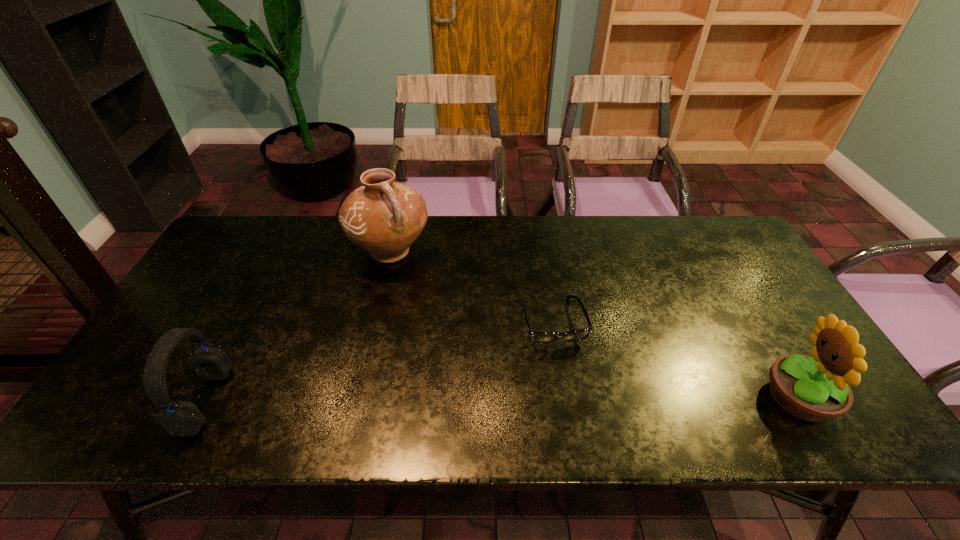
This screenshot has height=540, width=960. In order to click on vacant region located on the face of the sunflower in this screenshot , I will do `click(711, 397)`.

Image resolution: width=960 pixels, height=540 pixels. Identify the location of free location located 0.250m on the side of the third object from right to left with the handle. (437, 334).

Image resolution: width=960 pixels, height=540 pixels. Identify the location of vacant region located 0.380m on the side of the third object from right to left with the handle. (457, 371).

Where is `free location located on the side of the third object from right to left with the handle`? free location located on the side of the third object from right to left with the handle is located at coordinates (418, 300).

Locate an element on the screen. The height and width of the screenshot is (540, 960). vacant space situated 0.130m on the lenses of the spectacles is located at coordinates (573, 394).

Locate an element on the screen. object that is at the far edge is located at coordinates (383, 217).

This screenshot has height=540, width=960. I want to click on headset that is at the near edge, so click(x=179, y=418).

This screenshot has height=540, width=960. I want to click on sunflower present at the near edge, so click(x=816, y=388).

Identify the location of object located at the right edge. The image size is (960, 540). (816, 388).

At what (x,y) coordinates should I click in order to perform the action: click on object located at the near right corner. Please return your answer as a coordinate pair (x, y). The height and width of the screenshot is (540, 960). Looking at the image, I should click on (816, 388).